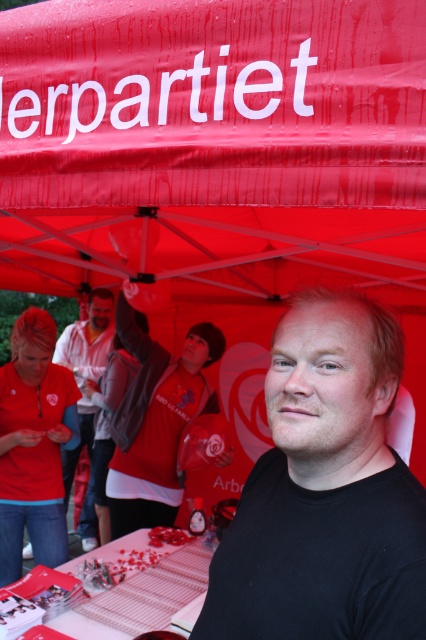
Looking at this image, you are standing outside the red canopy tent and see two people inside. One is wearing a black matte shirt at center and the other a matte white shirt at center. From your vantage point, which shirt is positioned to the right of the other?

The black matte shirt at center is positioned to the right of the matte white shirt at center.

You are standing in front of the red canopy tent with the word erpartiet. You need to place a 1.5 meter long banner on the matte plastic table at center. Will the banner fit on the table?

The matte plastic table at center is 1.79 meters from viewer, so the banner will fit as it is shorter than the table length.

You are at an outdoor event under a red canopy tent. You see a man in a black matte shirt at center and a matte plastic table at center. Which object is closer to you?

The black matte shirt at center is closer to you because it is in front of the matte plastic table at center.